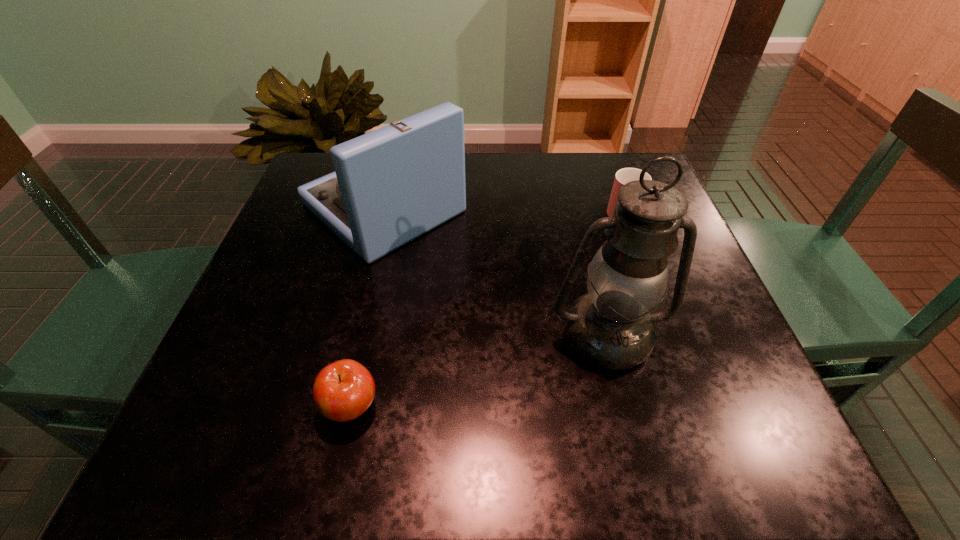
Find the location of `vacant space at the near edge of the desktop`. vacant space at the near edge of the desktop is located at coordinates (597, 463).

This screenshot has width=960, height=540. Identify the location of vacant space at the left edge of the desktop. (327, 311).

The width and height of the screenshot is (960, 540). I want to click on blank space at the right edge of the desktop, so click(697, 369).

Locate an element on the screen. free space at the near left corner of the desktop is located at coordinates coord(201,456).

In the image, there is a desktop. Where is `blank space at the far right corner`? Image resolution: width=960 pixels, height=540 pixels. blank space at the far right corner is located at coordinates (595, 158).

I want to click on vacant space that's between the second tallest object and the cup, so point(503,208).

Identify the location of vacant area that lies between the tallest object and the phonograph record. (495, 271).

Where is `unoccupied position between the apple and the third shortest object`? unoccupied position between the apple and the third shortest object is located at coordinates pos(368,307).

The height and width of the screenshot is (540, 960). In order to click on free space between the third farthest object and the phonograph record in this screenshot , I will do `click(495, 271)`.

This screenshot has height=540, width=960. Find the location of `free space between the apple and the phonograph record`. free space between the apple and the phonograph record is located at coordinates (368, 307).